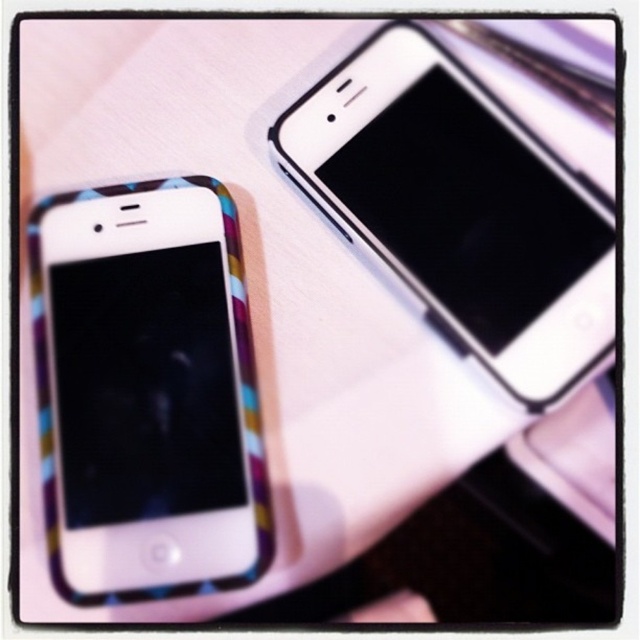
The image size is (640, 640). Describe the element at coordinates (147, 392) in the screenshot. I see `matte plastic phone at left` at that location.

Who is taller, matte plastic phone at left or white glossy smartphone at upper right?

matte plastic phone at left

Who is more distant from viewer, (49, 417) or (403, 284)?

The point (403, 284) is more distant.

Find the location of `matte plastic phone at left`. matte plastic phone at left is located at coordinates (147, 392).